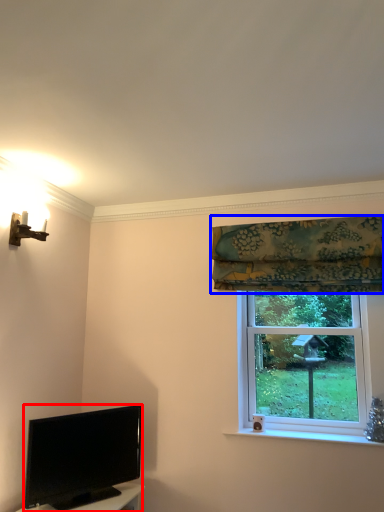
Question: Among these objects, which one is nearest to the camera, television (highlighted by a red box) or curtain (highlighted by a blue box)?

Choices:
 (A) television
 (B) curtain

Answer: (A)